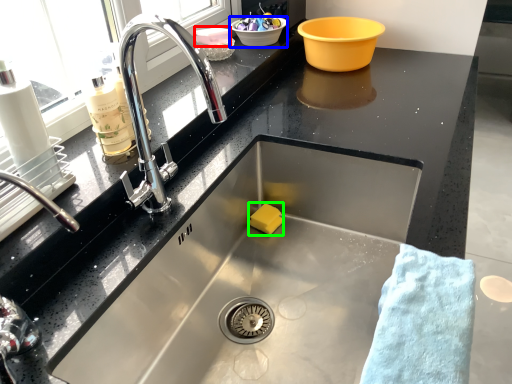
Question: Which is farther away from food (highlighted by a red box)? basin (highlighted by a blue box) or food (highlighted by a green box)?

Choices:
 (A) basin
 (B) food

Answer: (B)